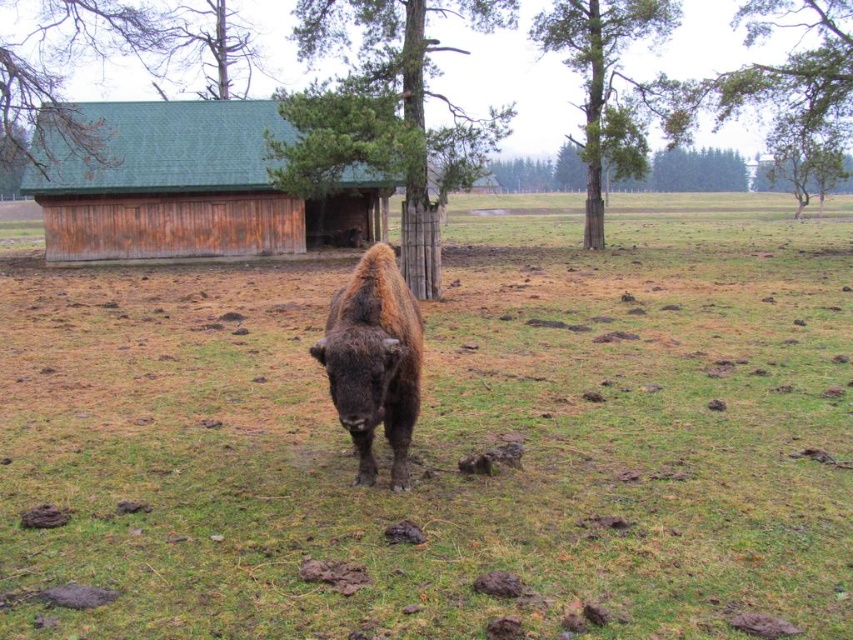
Does point (833, 49) come in front of point (582, 48)?

Yes, it is.

Is the position of green leafy tree at upper right more distant than that of green rough bark tree at upper center?

No.

Describe the element at coordinates (785, 88) in the screenshot. I see `green leafy tree at upper right` at that location.

Image resolution: width=853 pixels, height=640 pixels. I want to click on green leafy tree at upper right, so click(x=785, y=88).

Looking at this image, does green shingled roof at upper left have a greater width compared to green rough bark tree at upper center?

Yes, green shingled roof at upper left is wider than green rough bark tree at upper center.

Is green shingled roof at upper left to the right of green rough bark tree at upper center from the viewer's perspective?

No, green shingled roof at upper left is not to the right of green rough bark tree at upper center.

You are a GUI agent. You are given a task and a screenshot of the screen. Output one action in this format:
    pyautogui.click(x=<x>, y=<y>)
    Task: Click on the green shingled roof at upper left
    This screenshot has width=853, height=640.
    Given the screenshot: What is the action you would take?
    pyautogui.click(x=61, y=76)

Locate an element on the screen. green shingled roof at upper left is located at coordinates (61, 76).

Does green grassy field at center have a greater height compared to green rough bark tree at upper center?

Incorrect, green grassy field at center's height is not larger of green rough bark tree at upper center's.

Between green grassy field at center and green rough bark tree at upper center, which one appears on the right side from the viewer's perspective?

Positioned to the right is green rough bark tree at upper center.

Describe the element at coordinates (444, 435) in the screenshot. This screenshot has width=853, height=640. I see `green grassy field at center` at that location.

You are a GUI agent. You are given a task and a screenshot of the screen. Output one action in this format:
    pyautogui.click(x=<x>, y=<y>)
    Task: Click on the green grassy field at center
    
    Given the screenshot: What is the action you would take?
    pyautogui.click(x=444, y=435)